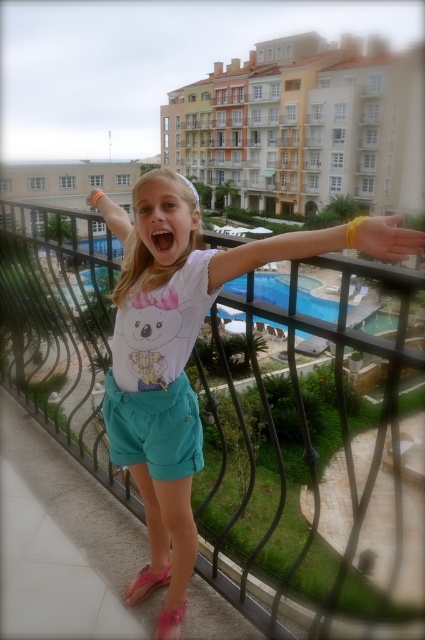
Question: Estimate the real-world distances between objects in this image. Which object is farther from the pink satin sandal at lower center?

Choices:
 (A) yellow rubber band at upper center
 (B) blue glass pool at center
 (C) teal fabric shorts at center
 (D) pink fabric sandal at lower center

Answer: (B)

Question: Can you confirm if blue glass pool at center is smaller than pink fabric sandal at lower center?

Choices:
 (A) yes
 (B) no

Answer: (B)

Question: Can you confirm if blue glass pool at center is wider than pink fabric sandal at lower center?

Choices:
 (A) yes
 (B) no

Answer: (A)

Question: Which of the following is the closest to the observer?

Choices:
 (A) pink satin sandal at lower center
 (B) white cotton shirt at center
 (C) yellow rubber band at upper center
 (D) teal fabric shorts at center

Answer: (B)

Question: Does teal fabric shorts at center have a lesser width compared to pink satin sandal at lower center?

Choices:
 (A) no
 (B) yes

Answer: (A)

Question: Which point is closer to the camera?

Choices:
 (A) (164, 625)
 (B) (150, 573)
 (C) (153, 554)
 (D) (223, 300)

Answer: (D)